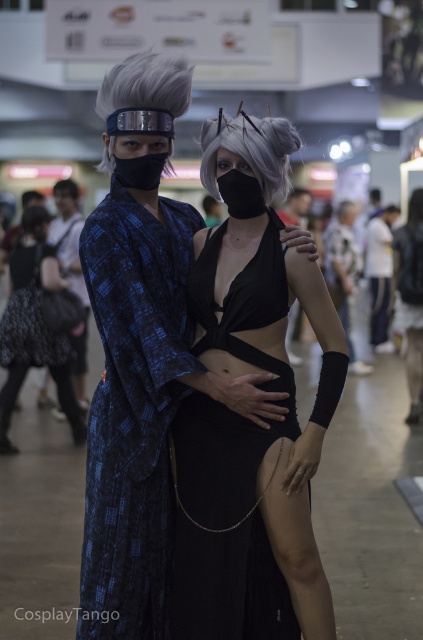
Is blue patterned kimono at center below matte black kimono at center?

Correct, blue patterned kimono at center is located below matte black kimono at center.

Between blue patterned kimono at center and matte black kimono at center, which one appears on the left side from the viewer's perspective?

From the viewer's perspective, blue patterned kimono at center appears more on the left side.

Identify the location of blue patterned kimono at center. Image resolution: width=423 pixels, height=640 pixels. (132, 410).

Is black matte dress at center in front of blue patterned kimono at center?

That is False.

Does black matte dress at center appear over blue patterned kimono at center?

Correct, black matte dress at center is located above blue patterned kimono at center.

Identify the location of black matte dress at center. (247, 419).

Does sleek silver wig at center appear under matte black kimono at center?

Actually, sleek silver wig at center is above matte black kimono at center.

Which is in front, point (257, 141) or point (337, 275)?

Point (257, 141)

Between point (280, 150) and point (329, 257), which one is positioned behind?

Positioned behind is point (329, 257).

Locate an element on the screen. sleek silver wig at center is located at coordinates (249, 148).